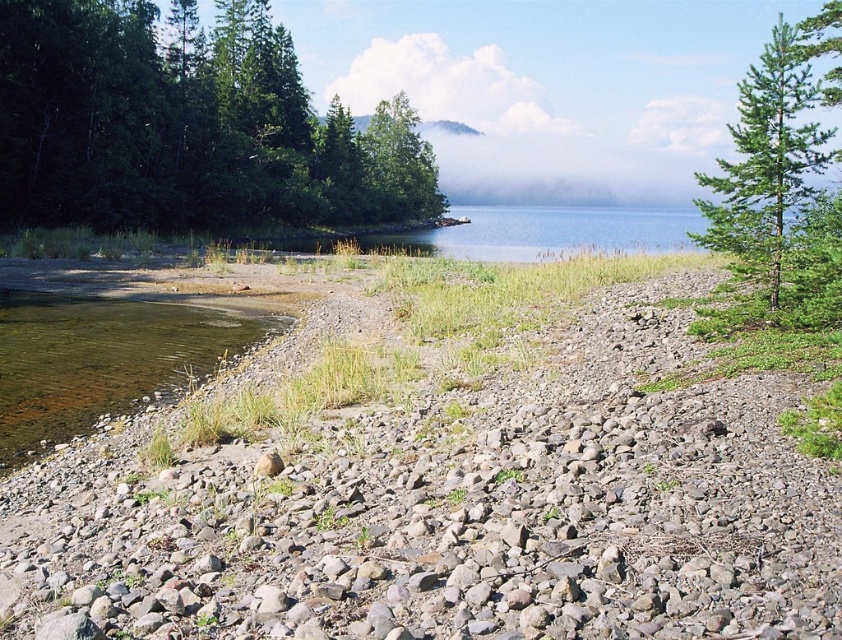
Question: Does gray gravel at lower left appear over green leafy tree at left?

Choices:
 (A) yes
 (B) no

Answer: (B)

Question: Which object appears closest to the camera in this image?

Choices:
 (A) green leafy tree at left
 (B) gray gravel at lower left

Answer: (B)

Question: In this image, where is green leafy tree at left located relative to green textured pine tree at upper right?

Choices:
 (A) right
 (B) left

Answer: (B)

Question: Among these objects, which one is nearest to the camera?

Choices:
 (A) green textured pine tree at upper right
 (B) gray gravel at lower left

Answer: (B)

Question: Which of the following is the farthest from the observer?

Choices:
 (A) (248, 580)
 (B) (760, 225)
 (C) (377, 200)

Answer: (C)

Question: Is green leafy tree at left positioned at the back of green textured pine tree at upper right?

Choices:
 (A) yes
 (B) no

Answer: (A)